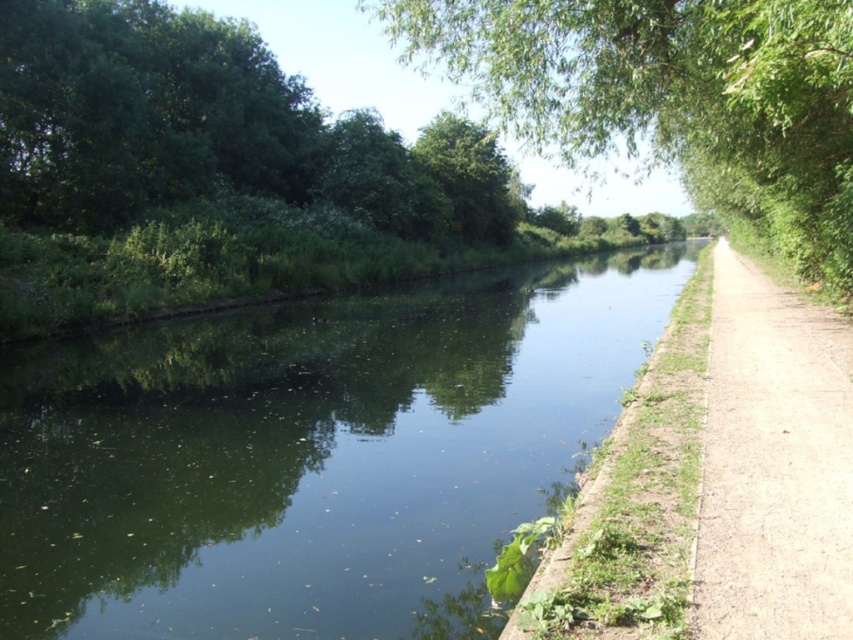
You are standing on the dirt path at right and want to take a photo of the green leafy tree at center. Which direction should you face to capture the tree in your view?

You should face to the left to capture the green leafy tree at center since it is located to the left of the dirt path at right.

You are a photographer planning to capture the green reflective water at center and the green leafy tree at center in a single shot. Based on their sizes, which object should you focus on to ensure both are clearly visible in the frame?

The green reflective water at center has a smaller size compared to green leafy tree at center. To ensure both are clearly visible, focus on the green leafy tree at center since it is larger and will remain in focus while the smaller water area can be framed around it.

You are standing at the point labeled point (699, 179) and want to reach the point labeled point (109, 394). Which direction should you move in to get there?

You should move forward because point (109, 394) is in front of point (699, 179).